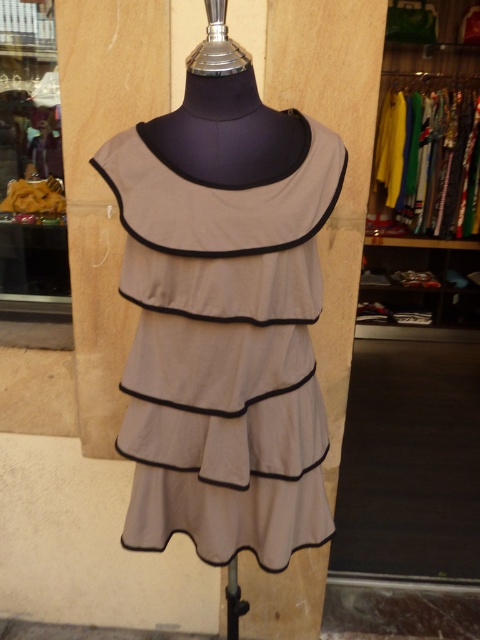
You are a customer looking at the display outside a store. You see the beige cotton dress at center and the matte yellow purse at left. Which item is closer to you?

The beige cotton dress at center is closer to you because it is in front of the matte yellow purse at left.